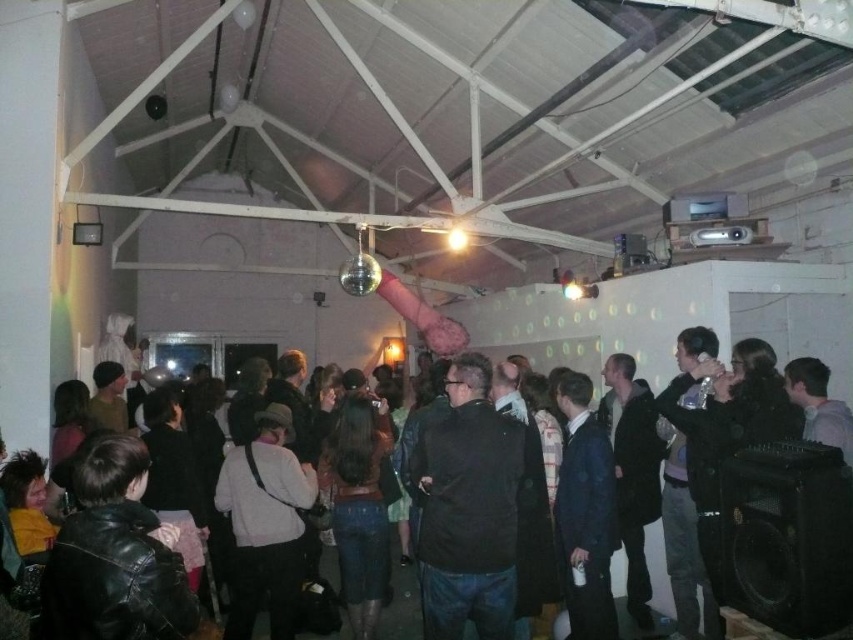
Question: Is black leather jacket at center bigger than leather jacket at center?

Choices:
 (A) no
 (B) yes

Answer: (B)

Question: Does black matte speaker at lower right have a smaller size compared to leather jacket at center?

Choices:
 (A) yes
 (B) no

Answer: (B)

Question: Is black leather jacket at center closer to camera compared to leather jacket at center?

Choices:
 (A) no
 (B) yes

Answer: (B)

Question: Estimate the real-world distances between objects in this image. Which object is farther from the black leather jacket at center?

Choices:
 (A) leather jacket at center
 (B) black matte speaker at lower right

Answer: (A)

Question: Which of the following is the closest to the observer?

Choices:
 (A) leather jacket at center
 (B) black leather jacket at center

Answer: (B)

Question: Which point is farther to the camera?

Choices:
 (A) black matte speaker at lower right
 (B) leather jacket at center
 (C) black leather jacket at center

Answer: (B)